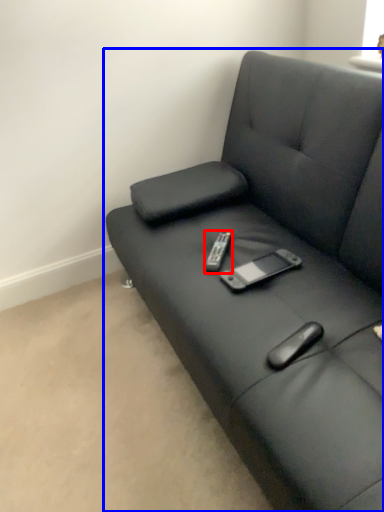
Question: Which of the following is the closest to the observer, remote (highlighted by a red box) or studio couch (highlighted by a blue box)?

Choices:
 (A) remote
 (B) studio couch

Answer: (B)